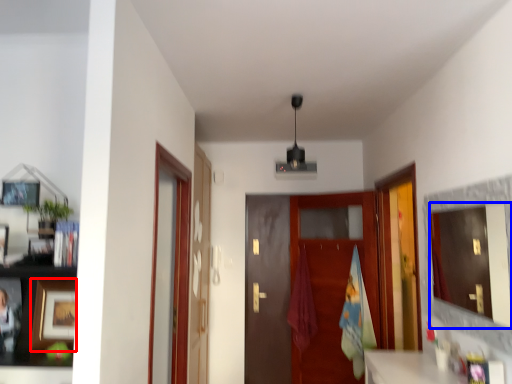
Question: Which of the following is the farthest to the observer, picture frame (highlighted by a red box) or mirror (highlighted by a blue box)?

Choices:
 (A) picture frame
 (B) mirror

Answer: (A)